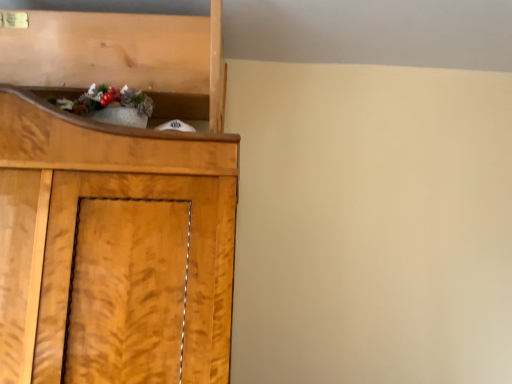
Question: Can you confirm if shiny metallic ornament at upper left is wider than wooden shelf at upper left?

Choices:
 (A) no
 (B) yes

Answer: (A)

Question: Does shiny metallic ornament at upper left appear on the left side of wooden shelf at upper left?

Choices:
 (A) no
 (B) yes

Answer: (A)

Question: Does shiny metallic ornament at upper left turn towards wooden shelf at upper left?

Choices:
 (A) no
 (B) yes

Answer: (B)

Question: Does shiny metallic ornament at upper left have a smaller size compared to wooden shelf at upper left?

Choices:
 (A) no
 (B) yes

Answer: (B)

Question: From a real-world perspective, is shiny metallic ornament at upper left located higher than wooden shelf at upper left?

Choices:
 (A) no
 (B) yes

Answer: (A)

Question: Is shiny metallic ornament at upper left further to the viewer compared to wooden shelf at upper left?

Choices:
 (A) no
 (B) yes

Answer: (A)

Question: Can you confirm if wooden shelf at upper left is taller than shiny metallic ornament at upper left?

Choices:
 (A) no
 (B) yes

Answer: (B)

Question: From a real-world perspective, does wooden shelf at upper left sit lower than shiny metallic ornament at upper left?

Choices:
 (A) yes
 (B) no

Answer: (B)

Question: Considering the relative sizes of wooden shelf at upper left and shiny metallic ornament at upper left in the image provided, is wooden shelf at upper left bigger than shiny metallic ornament at upper left?

Choices:
 (A) yes
 (B) no

Answer: (A)

Question: Is wooden shelf at upper left at the right side of shiny metallic ornament at upper left?

Choices:
 (A) no
 (B) yes

Answer: (A)

Question: Could shiny metallic ornament at upper left be considered to be inside wooden shelf at upper left?

Choices:
 (A) no
 (B) yes

Answer: (B)

Question: Can you confirm if wooden shelf at upper left is shorter than shiny metallic ornament at upper left?

Choices:
 (A) no
 (B) yes

Answer: (A)

Question: Visually, is shiny metallic ornament at upper left positioned to the left or to the right of wooden shelf at upper left?

Choices:
 (A) right
 (B) left

Answer: (A)